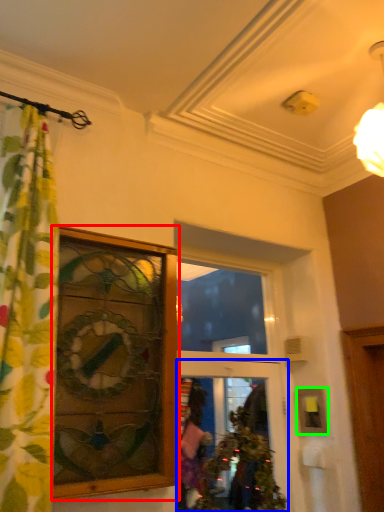
Question: Based on their relative distances, which object is farther from window (highlighted by a red box)? Choose from door (highlighted by a blue box) and picture frame (highlighted by a green box).

Choices:
 (A) door
 (B) picture frame

Answer: (B)